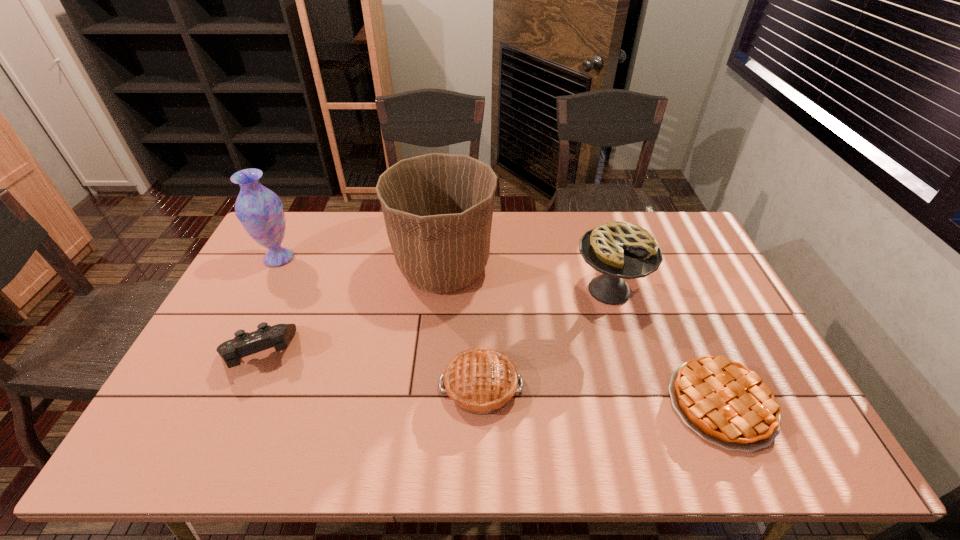
Where is `flowerpot`? This screenshot has height=540, width=960. flowerpot is located at coordinates (438, 208).

Locate an element on the screen. The image size is (960, 540). vase is located at coordinates (260, 211).

The image size is (960, 540). Find the location of `the tallest pie`. the tallest pie is located at coordinates (620, 250).

At what (x,y) coordinates should I click in order to perform the action: click on the farthest pie. Please return your answer as a coordinate pair (x, y). Looking at the image, I should click on (620, 250).

Where is `control`? Image resolution: width=960 pixels, height=540 pixels. control is located at coordinates (244, 344).

At what (x,y) coordinates should I click in order to perform the action: click on the second shortest object. Please return your answer as a coordinate pair (x, y). This screenshot has width=960, height=540. Looking at the image, I should click on (481, 381).

The image size is (960, 540). Find the location of `the leftmost pie`. the leftmost pie is located at coordinates (481, 381).

Locate an element on the screen. This screenshot has width=960, height=540. the shortest object is located at coordinates (725, 403).

Locate an element on the screen. The image size is (960, 540). free spot located on the left of the flowerpot is located at coordinates (328, 268).

Identify the location of vacant area situated 0.090m on the front of the vase. This screenshot has width=960, height=540. tap(262, 291).